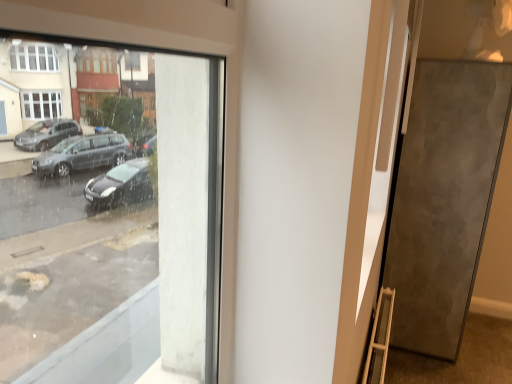
Question: From the image's perspective, is wooden ladder at lower right below matte gray door at right?

Choices:
 (A) yes
 (B) no

Answer: (A)

Question: Are wooden ladder at lower right and matte gray door at right beside each other?

Choices:
 (A) no
 (B) yes

Answer: (A)

Question: Are wooden ladder at lower right and matte gray door at right far apart?

Choices:
 (A) yes
 (B) no

Answer: (B)

Question: Considering the relative positions of wooden ladder at lower right and matte gray door at right in the image provided, is wooden ladder at lower right behind matte gray door at right?

Choices:
 (A) no
 (B) yes

Answer: (A)

Question: Can you confirm if wooden ladder at lower right is taller than matte gray door at right?

Choices:
 (A) no
 (B) yes

Answer: (A)

Question: From a real-world perspective, is metallic gray pavement at lower right above or below wooden ladder at lower right?

Choices:
 (A) below
 (B) above

Answer: (A)

Question: Is metallic gray pavement at lower right in front of or behind wooden ladder at lower right in the image?

Choices:
 (A) front
 (B) behind

Answer: (B)

Question: From the image's perspective, is metallic gray pavement at lower right positioned above or below wooden ladder at lower right?

Choices:
 (A) above
 (B) below

Answer: (B)

Question: Choose the correct answer: Is metallic gray pavement at lower right inside wooden ladder at lower right or outside it?

Choices:
 (A) outside
 (B) inside

Answer: (A)

Question: Relative to metallic gray pavement at lower right, is matte gray door at right in front or behind?

Choices:
 (A) front
 (B) behind

Answer: (B)

Question: Would you say matte gray door at right is to the left or to the right of metallic gray pavement at lower right in the picture?

Choices:
 (A) right
 (B) left

Answer: (B)

Question: Considering the positions of matte gray door at right and metallic gray pavement at lower right in the image, is matte gray door at right bigger or smaller than metallic gray pavement at lower right?

Choices:
 (A) small
 (B) big

Answer: (B)

Question: Considering the positions of matte gray door at right and metallic gray pavement at lower right in the image, is matte gray door at right taller or shorter than metallic gray pavement at lower right?

Choices:
 (A) tall
 (B) short

Answer: (A)

Question: Does point click(x=379, y=314) appear closer or farther from the camera than point click(x=407, y=332)?

Choices:
 (A) closer
 (B) farther

Answer: (A)

Question: In the image, is wooden ladder at lower right positioned in front of or behind matte gray door at right?

Choices:
 (A) behind
 (B) front

Answer: (B)